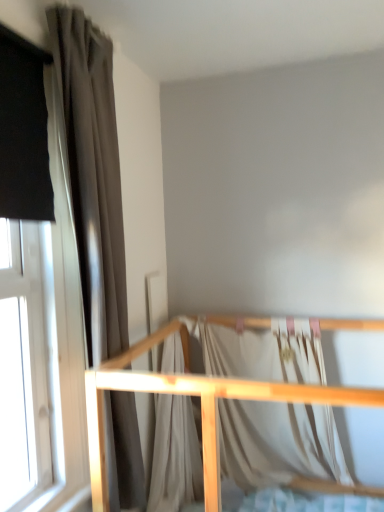
Question: From the image's perspective, relative to light wood crib rail at lower center, is silky white fabric at center above or below?

Choices:
 (A) below
 (B) above

Answer: (B)

Question: In terms of height, does silky white fabric at center look taller or shorter compared to light wood crib rail at lower center?

Choices:
 (A) tall
 (B) short

Answer: (B)

Question: Based on their relative distances, which object is farther from the silky white fabric at center?

Choices:
 (A) light wood crib rail at lower center
 (B) matte gray curtain at left

Answer: (B)

Question: Which object is the closest to the matte gray curtain at left?

Choices:
 (A) light wood crib rail at lower center
 (B) silky white fabric at center

Answer: (A)